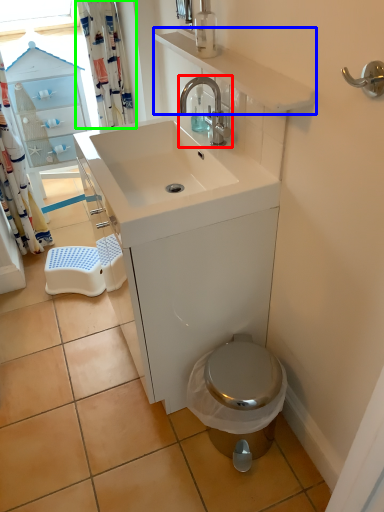
Question: Which object is positioned farthest from tap (highlighted by a red box)? Select from counter top (highlighted by a blue box) and shower curtain (highlighted by a green box).

Choices:
 (A) counter top
 (B) shower curtain

Answer: (B)